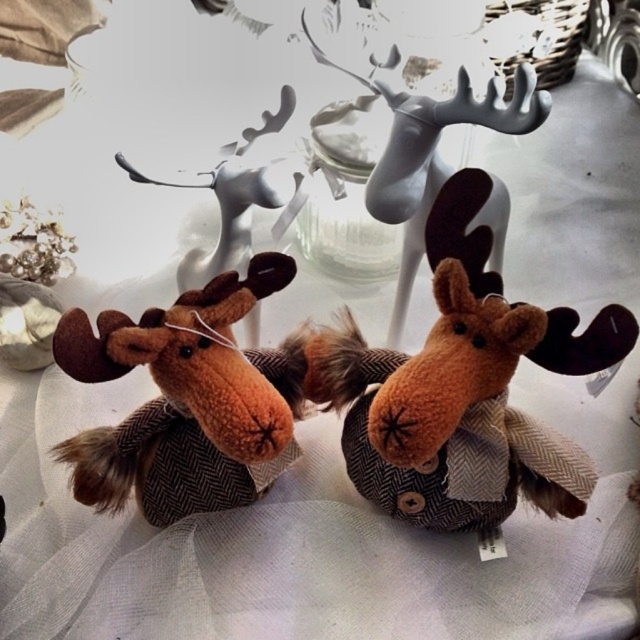
Question: Considering the relative positions of brown fuzzy moose at center and matte white antlers at upper center in the image provided, where is brown fuzzy moose at center located with respect to matte white antlers at upper center?

Choices:
 (A) left
 (B) right

Answer: (A)

Question: Can you confirm if brown fuzzy moose at center is positioned to the right of matte white antlers at upper center?

Choices:
 (A) no
 (B) yes

Answer: (A)

Question: Which of the following is the closest to the observer?

Choices:
 (A) (474, 112)
 (B) (163, 392)

Answer: (B)

Question: Does brown fuzzy moose at center appear on the right side of matte white antlers at upper center?

Choices:
 (A) no
 (B) yes

Answer: (A)